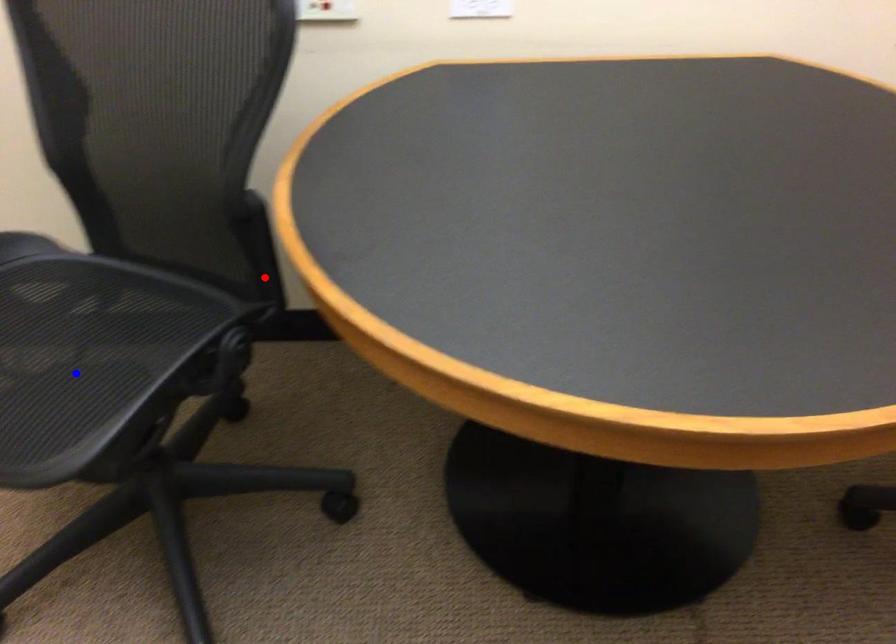
Question: In the image, two points are highlighted. Which point is nearer to the camera? Reply with the corresponding letter.

Choices:
 (A) blue point
 (B) red point

Answer: (A)